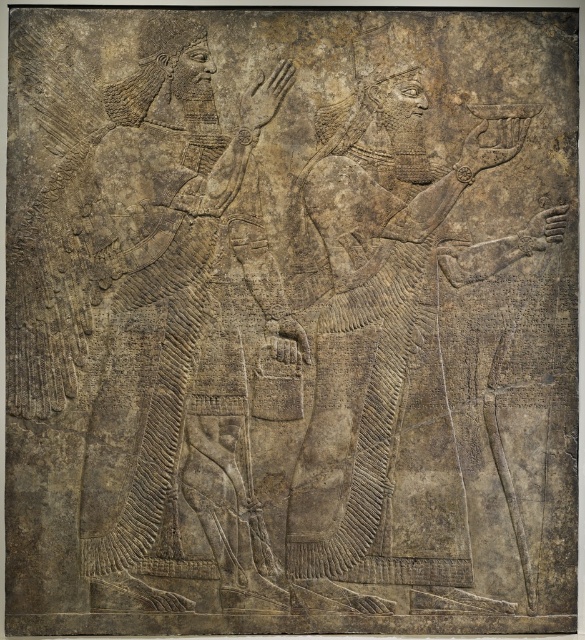
Question: Can you confirm if carved stone figure at center is positioned to the left of gray stone figure at left?

Choices:
 (A) yes
 (B) no

Answer: (B)

Question: Is carved stone figure at center below gray stone figure at left?

Choices:
 (A) no
 (B) yes

Answer: (B)

Question: Among these points, which one is nearest to the camera?

Choices:
 (A) (476, 128)
 (B) (226, 552)

Answer: (B)

Question: Observing the image, what is the correct spatial positioning of carved stone figure at center in reference to gray stone figure at left?

Choices:
 (A) above
 (B) below

Answer: (B)